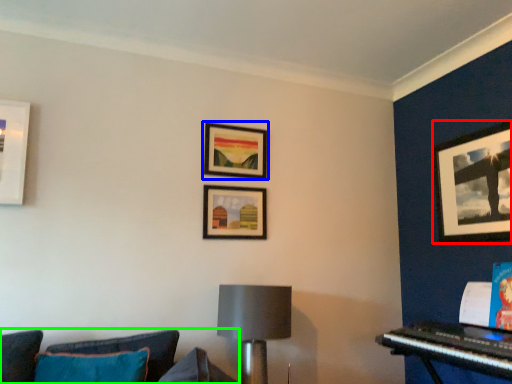
Question: Which object is positioned closest to picture frame (highlighted by a red box)? Select from picture frame (highlighted by a blue box) and studio couch (highlighted by a green box).

Choices:
 (A) picture frame
 (B) studio couch

Answer: (A)